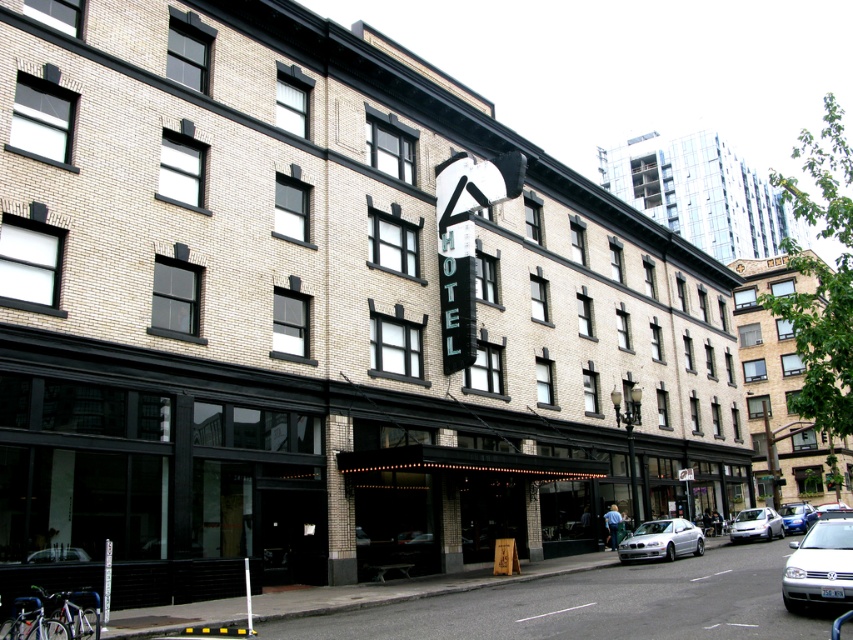
How distant is white matte sedan at lower right from metallic blue sedan at center-right?

white matte sedan at lower right is 28.41 meters from metallic blue sedan at center-right.

In the scene shown: Is the position of white matte sedan at lower right less distant than that of metallic blue sedan at center-right?

Yes, white matte sedan at lower right is closer to the viewer.

Measure the distance between point [840,602] and camera.

Point [840,602] and camera are 17.99 meters apart.

Find the location of `white matte sedan at lower right`. white matte sedan at lower right is located at coordinates (819, 564).

Can you confirm if white matte sedan at lower right is taller than white glossy sedan at lower right?

Indeed, white matte sedan at lower right has a greater height compared to white glossy sedan at lower right.

Who is higher up, white matte sedan at lower right or white glossy sedan at lower right?

Positioned higher is white matte sedan at lower right.

Where is `white matte sedan at lower right`? The height and width of the screenshot is (640, 853). white matte sedan at lower right is located at coordinates (819, 564).

Does point (820, 579) lie behind point (732, 528)?

No, it is not.

Based on the photo, is white matte sedan at lower right bigger than silver metallic sedan at center?

Yes.

Between point (817, 572) and point (752, 532), which one is positioned behind?

The point (752, 532) is behind.

Locate an element on the screen. This screenshot has height=640, width=853. white matte sedan at lower right is located at coordinates (819, 564).